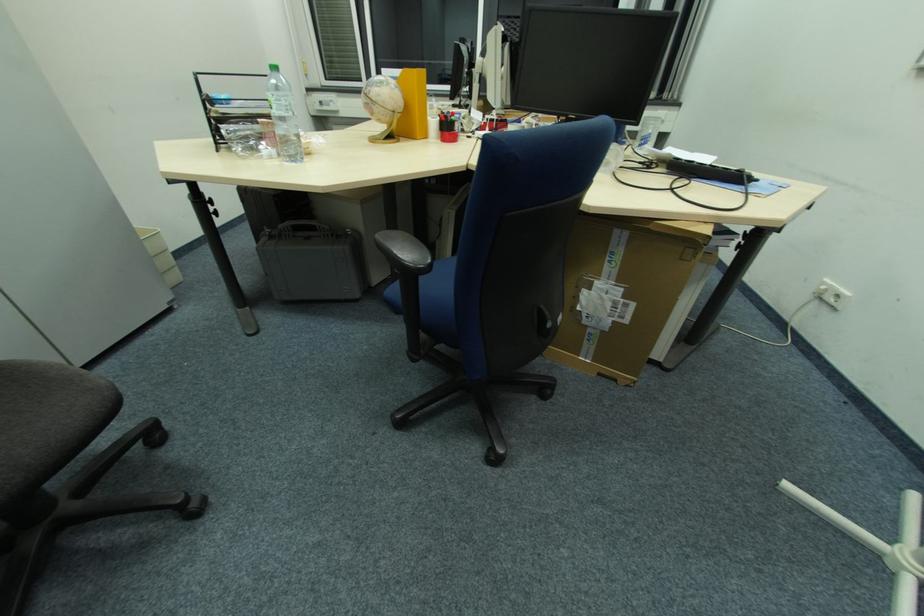
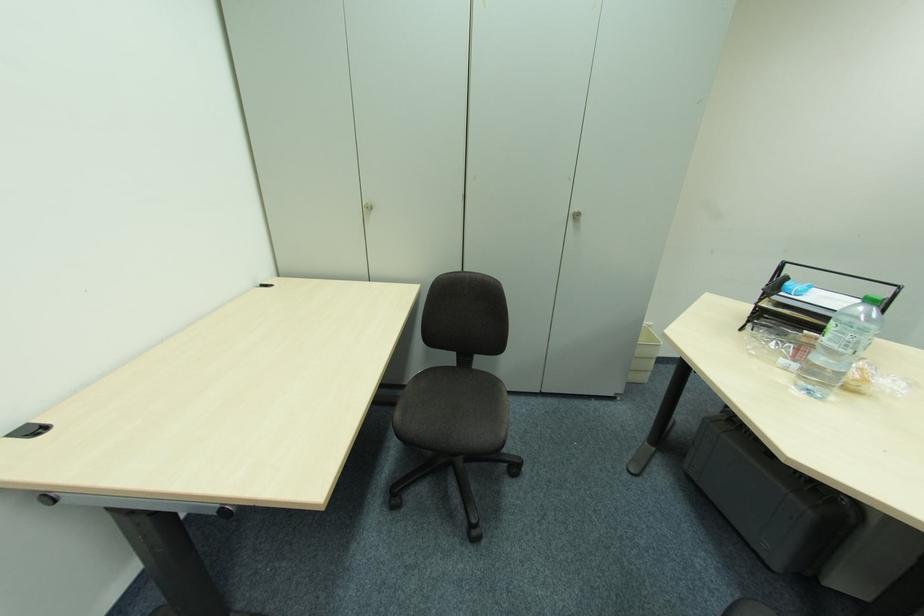
Find the pixel in the second image that matches (x=289, y=111) in the first image.

(850, 347)